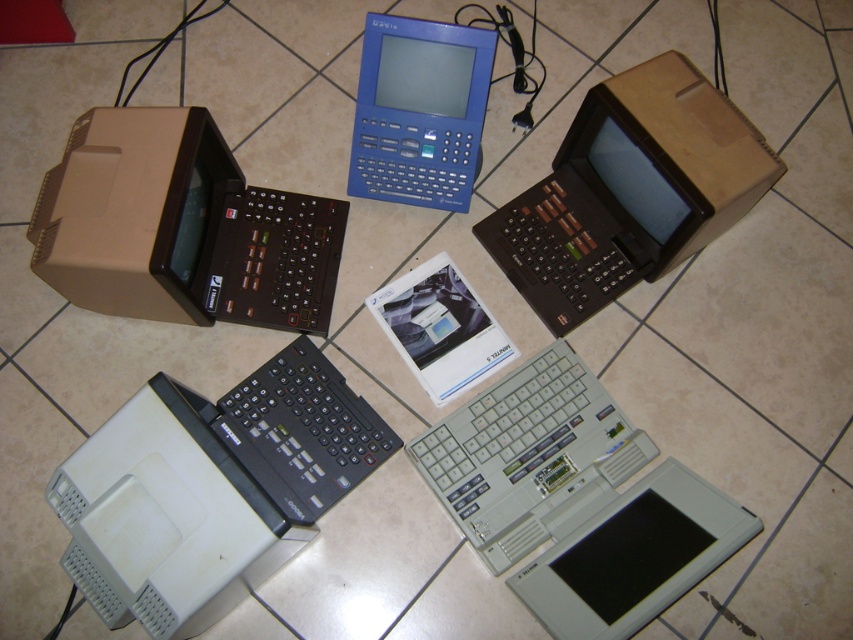
Is brown matte/soft plastic computer at upper left behind gray plastic laptop at center?

No, brown matte/soft plastic computer at upper left is closer to the viewer.

Who is more distant from viewer, [131,260] or [556,397]?

The point [556,397] is behind.

You are a GUI agent. You are given a task and a screenshot of the screen. Output one action in this format:
    pyautogui.click(x=<x>, y=<y>)
    Task: Click on the brown matte/soft plastic computer at upper left
    The image size is (853, 640).
    Given the screenshot: What is the action you would take?
    pyautogui.click(x=180, y=227)

Locate an element on the screen. The width and height of the screenshot is (853, 640). gray plastic laptop at lower right is located at coordinates (634, 556).

Is the position of gray plastic laptop at lower right more distant than that of blue plastic handheld at upper center?

That is False.

Where is `gray plastic laptop at lower right`? gray plastic laptop at lower right is located at coordinates (634, 556).

Does brown matte/soft plastic computer at upper left appear over white plastic computer at bottom left?

Correct, brown matte/soft plastic computer at upper left is located above white plastic computer at bottom left.

Does point (149, 243) lie behind point (86, 502)?

Yes, it is.

Where is `brown matte/soft plastic computer at upper left`? This screenshot has height=640, width=853. brown matte/soft plastic computer at upper left is located at coordinates (180, 227).